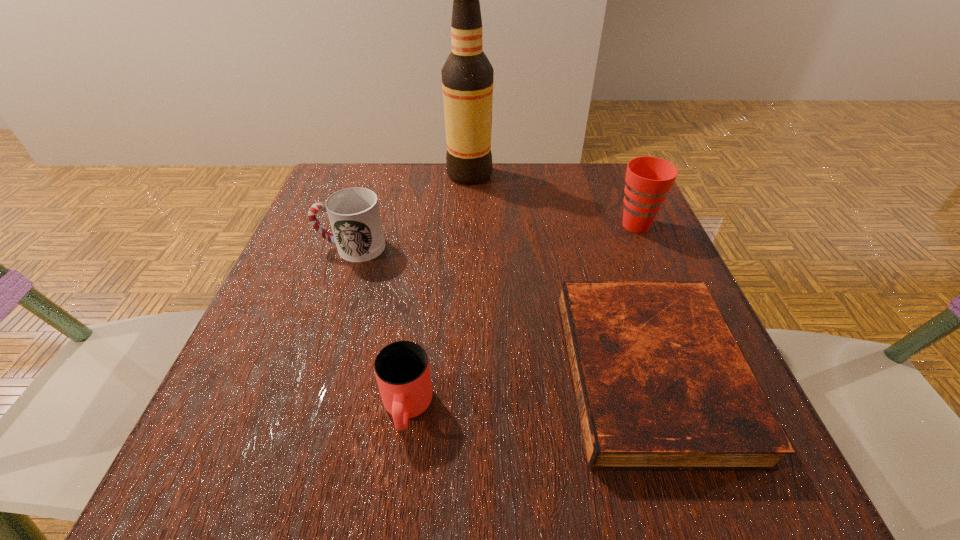
Image resolution: width=960 pixels, height=540 pixels. In order to click on the tallest object in this screenshot , I will do `click(467, 76)`.

Where is `the farthest object`? The width and height of the screenshot is (960, 540). the farthest object is located at coordinates (467, 76).

The height and width of the screenshot is (540, 960). I want to click on the rightmost cup, so click(x=648, y=179).

Where is `the tallest cup`? the tallest cup is located at coordinates (648, 179).

What are the coordinates of `the leftmost object` in the screenshot? It's located at (354, 215).

Identify the location of the third shortest object. (354, 215).

You are a GUI agent. You are given a task and a screenshot of the screen. Output one action in this format:
    pyautogui.click(x=<x>, y=<y>)
    Task: Click on the nearest cup
    Image resolution: width=960 pixels, height=540 pixels.
    Given the screenshot: What is the action you would take?
    pyautogui.click(x=402, y=370)

The image size is (960, 540). I want to click on the second cup from left to right, so click(x=402, y=370).

At what (x,y) coordinates should I click in order to perform the action: click on the shortest object. Please return your answer as a coordinate pair (x, y). Looking at the image, I should click on (661, 385).

Locate an element on the screen. vacant space located on the label of the alcohol is located at coordinates (560, 174).